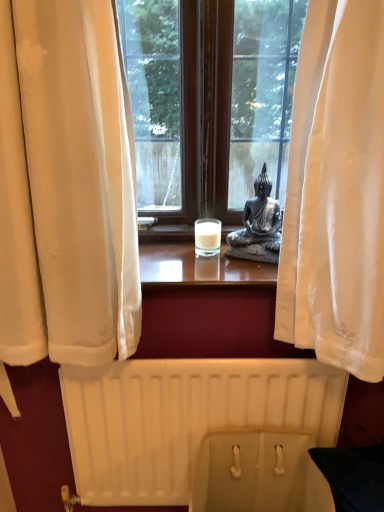
What is the approximate width of white frosted glass candle at center?

The width of white frosted glass candle at center is 2.30 inches.

You are a GUI agent. You are given a task and a screenshot of the screen. Output one action in this format:
    pyautogui.click(x=<x>, y=<y>)
    Task: Click on the white matte radiator at lower center
    The width and height of the screenshot is (384, 512).
    Given the screenshot: What is the action you would take?
    pyautogui.click(x=202, y=431)

Is the surface of beige fabric toilet bowl at lower center in direct contact with satin black statue at center?

No, beige fabric toilet bowl at lower center is not next to satin black statue at center.

Is beige fabric toilet bowl at lower center thinner than satin black statue at center?

No, beige fabric toilet bowl at lower center is not thinner than satin black statue at center.

From a real-world perspective, is beige fabric toilet bowl at lower center positioned under satin black statue at center based on gravity?

Correct, in the physical world, beige fabric toilet bowl at lower center is lower than satin black statue at center.

Looking at this image, does beige fabric toilet bowl at lower center have a smaller size compared to satin black statue at center?

No.

Is satin black statue at center bigger than white matte radiator at lower center?

No, satin black statue at center is not bigger than white matte radiator at lower center.

Is satin black statue at center not within white matte radiator at lower center?

Indeed, satin black statue at center is completely outside white matte radiator at lower center.

Is satin black statue at center to the left or to the right of white matte radiator at lower center in the image?

satin black statue at center is to the right of white matte radiator at lower center.

Is white matte radiator at lower center located within white frosted glass candle at center?

That's incorrect, white matte radiator at lower center is not inside white frosted glass candle at center.

Based on the photo, which of these two, white frosted glass candle at center or white matte radiator at lower center, is thinner?

white frosted glass candle at center is thinner.

Consider the image. Is the depth of white frosted glass candle at center less than that of white matte radiator at lower center?

No, white frosted glass candle at center is further to the viewer.

Which is closer to the camera, (218, 242) or (110, 411)?

The point (218, 242) is more forward.

From their relative heights in the image, would you say white frosted glass candle at center is taller or shorter than beige fabric toilet bowl at lower center?

Considering their sizes, white frosted glass candle at center has less height than beige fabric toilet bowl at lower center.

From the picture: Does white frosted glass candle at center turn towards beige fabric toilet bowl at lower center?

No, white frosted glass candle at center does not turn towards beige fabric toilet bowl at lower center.

Is white frosted glass candle at center closer to the viewer compared to beige fabric toilet bowl at lower center?

No, it is behind beige fabric toilet bowl at lower center.

What's the angular difference between satin black statue at center and white frosted glass candle at center's facing directions?

The facing directions of satin black statue at center and white frosted glass candle at center are 20.7 degrees apart.

Is satin black statue at center turned away from white frosted glass candle at center?

satin black statue at center does not have its back to white frosted glass candle at center.

From the image's perspective, between satin black statue at center and white frosted glass candle at center, who is located below?

white frosted glass candle at center.

Does satin black statue at center have a lesser height compared to white frosted glass candle at center?

No, satin black statue at center is not shorter than white frosted glass candle at center.

Identify the location of person above the beige fabric toilet bowl at lower center (from a real-world perspective). (260, 217).

In terms of width, does satin black statue at center look wider or thinner when compared to beige fabric toilet bowl at lower center?

Clearly, satin black statue at center has less width compared to beige fabric toilet bowl at lower center.

Is beige fabric toilet bowl at lower center inside satin black statue at center?

No, beige fabric toilet bowl at lower center is not inside satin black statue at center.

From a real-world perspective, which is physically below, satin black statue at center or beige fabric toilet bowl at lower center?

beige fabric toilet bowl at lower center is physically lower.

Which object is further away from the camera, white frosted glass candle at center or satin black statue at center?

white frosted glass candle at center is more distant.

Can you confirm if white frosted glass candle at center is bigger than satin black statue at center?

No, white frosted glass candle at center is not bigger than satin black statue at center.

Does white frosted glass candle at center have a lesser height compared to satin black statue at center?

Yes, white frosted glass candle at center is shorter than satin black statue at center.

Does point (212, 230) come behind point (262, 232)?

Yes, point (212, 230) is behind point (262, 232).

Image resolution: width=384 pixels, height=512 pixels. In order to click on toilet bowl on the right of satin black statue at center in this screenshot , I will do `click(258, 474)`.

Where is `radiator located below the satin black statue at center (from the image's perspective)`? This screenshot has height=512, width=384. radiator located below the satin black statue at center (from the image's perspective) is located at coordinates (202, 431).

Which object lies nearer to the anchor point beige fabric toilet bowl at lower center, white frosted glass candle at center or white matte radiator at lower center?

The object closer to beige fabric toilet bowl at lower center is white matte radiator at lower center.

When comparing their distances from satin black statue at center, does beige fabric toilet bowl at lower center or white frosted glass candle at center seem further?

beige fabric toilet bowl at lower center lies further to satin black statue at center than the other object.

From the image, which object appears to be farther from satin black statue at center, white matte radiator at lower center or white frosted glass candle at center?

white matte radiator at lower center.

From the image, which object appears to be farther from beige fabric toilet bowl at lower center, white matte radiator at lower center or satin black statue at center?

satin black statue at center lies further to beige fabric toilet bowl at lower center than the other object.

Looking at the image, which one is located closer to white matte radiator at lower center, beige fabric toilet bowl at lower center or white frosted glass candle at center?

beige fabric toilet bowl at lower center.

Looking at the image, which one is located further to white matte radiator at lower center, satin black statue at center or beige fabric toilet bowl at lower center?

The object further to white matte radiator at lower center is satin black statue at center.

Looking at this image, estimate the real-world distances between objects in this image. Which object is further from white matte radiator at lower center, satin black statue at center or white frosted glass candle at center?

white frosted glass candle at center lies further to white matte radiator at lower center than the other object.

In the scene shown: Looking at the image, which one is located further to white matte radiator at lower center, white frosted glass candle at center or satin black statue at center?

white frosted glass candle at center is further to white matte radiator at lower center.

Where is `candle between satin black statue at center and white matte radiator at lower center in the vertical direction`? The image size is (384, 512). candle between satin black statue at center and white matte radiator at lower center in the vertical direction is located at coordinates pyautogui.click(x=207, y=234).

Locate an element on the screen. Image resolution: width=384 pixels, height=512 pixels. radiator between white frosted glass candle at center and beige fabric toilet bowl at lower center vertically is located at coordinates (202, 431).

At what (x,y) coordinates should I click in order to perform the action: click on candle between satin black statue at center and beige fabric toilet bowl at lower center in the vertical direction. Please return your answer as a coordinate pair (x, y). Looking at the image, I should click on 207,234.

This screenshot has width=384, height=512. Identify the location of radiator that lies between satin black statue at center and beige fabric toilet bowl at lower center from top to bottom. (202, 431).